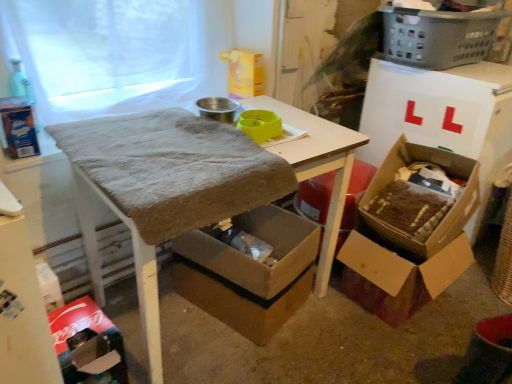
Question: Is white sheer fabric at upper left to the left or to the right of cardboard box at lower center, acting as the first box starting from the left, in the image?

Choices:
 (A) right
 (B) left

Answer: (B)

Question: In terms of size, does white sheer fabric at upper left appear bigger or smaller than cardboard box at lower center, the third box viewed from the right?

Choices:
 (A) big
 (B) small

Answer: (B)

Question: Which object is positioned farthest from the gray plastic laundry basket at upper right?

Choices:
 (A) cardboard box at right, the 3th box from the left
 (B) cardboard box at lower center, acting as the first box starting from the left
 (C) textured brown table at center
 (D) cardboard box at lower left
 (E) brown cardboard box at lower right, acting as the second box starting from the right

Answer: (D)

Question: Which is nearer to the cardboard box at lower left?

Choices:
 (A) cardboard box at lower center, the third box viewed from the right
 (B) textured brown table at center
 (C) gray plastic laundry basket at upper right
 (D) cardboard box at right, the 3th box from the left
 (E) white sheer fabric at upper left

Answer: (A)